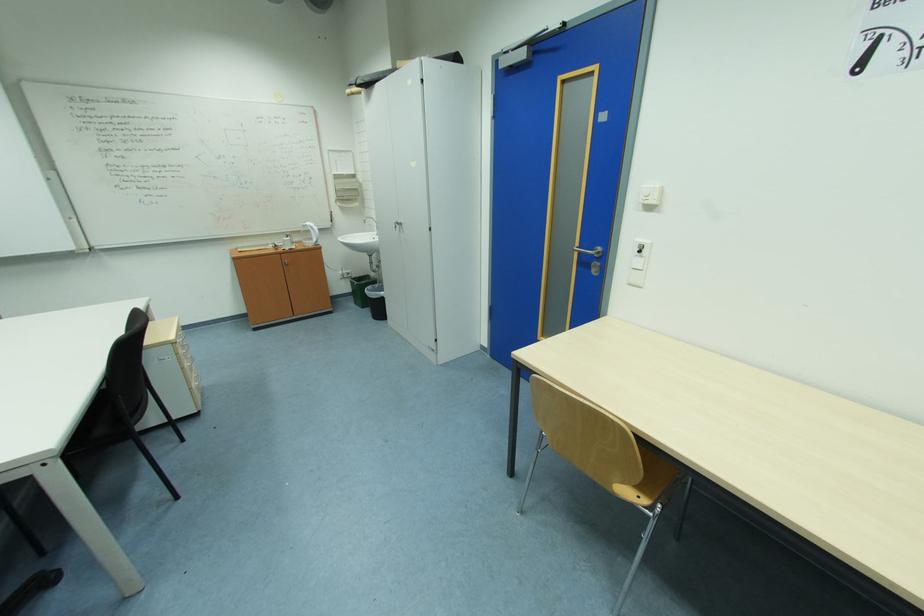
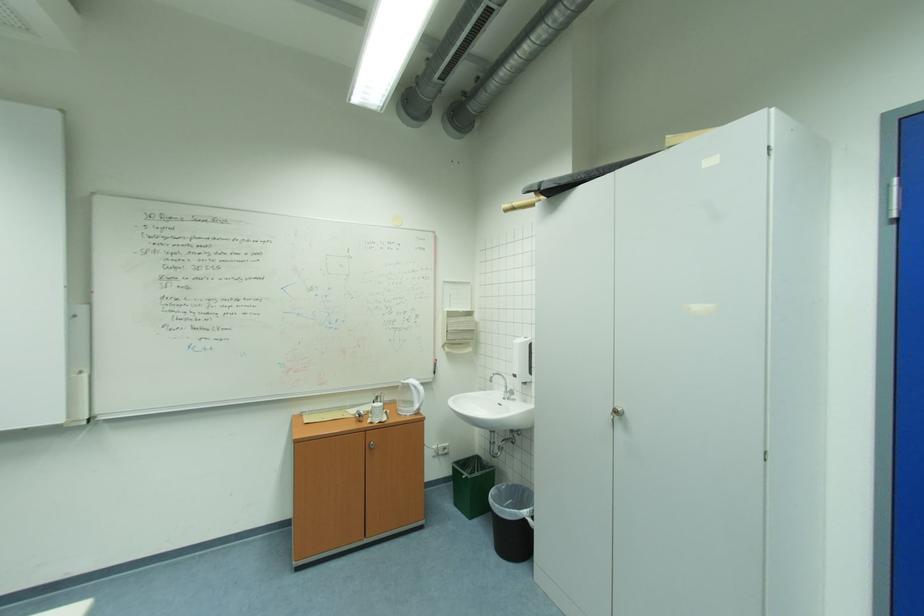
In the second image, find the point that corresponds to pixel 362 304 in the first image.

(464, 505)